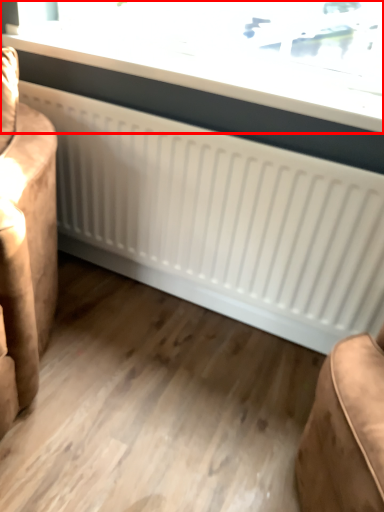
Question: From the image, what is the correct spatial relationship of window (annotated by the red box) in relation to furniture?

Choices:
 (A) right
 (B) left

Answer: (A)